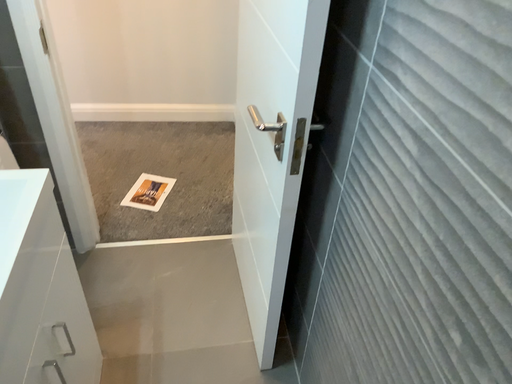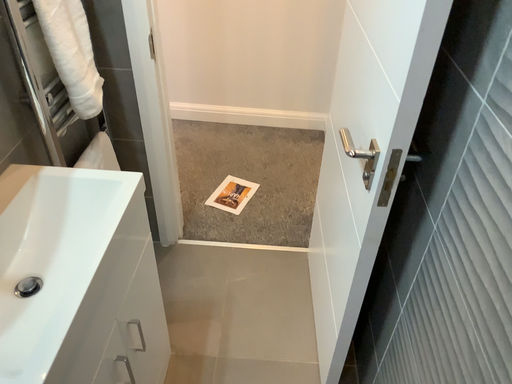
Question: How did the camera likely rotate when shooting the video?

Choices:
 (A) rotated left
 (B) rotated right

Answer: (A)